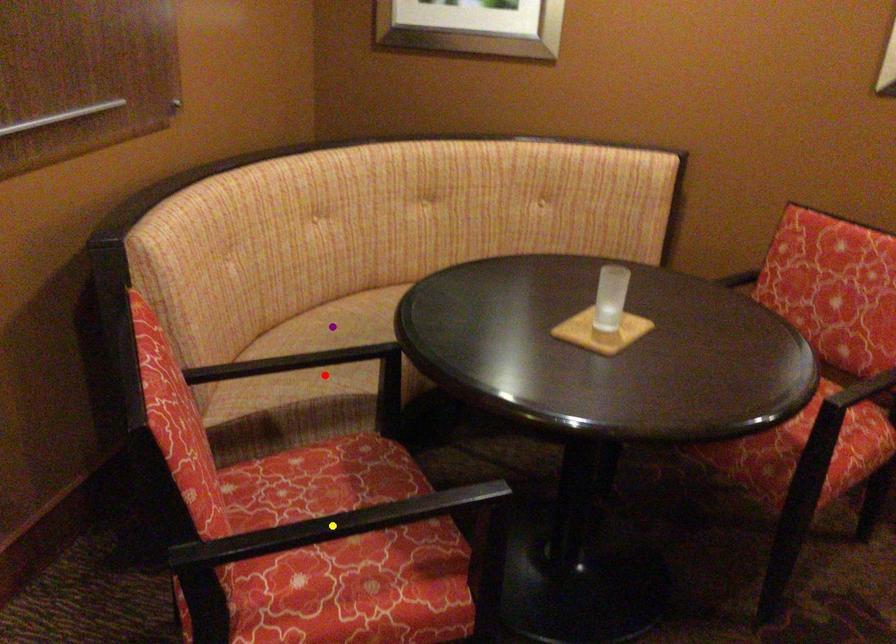
Order these from nearest to farthest:
A) purple point
B) red point
C) yellow point

purple point → red point → yellow point